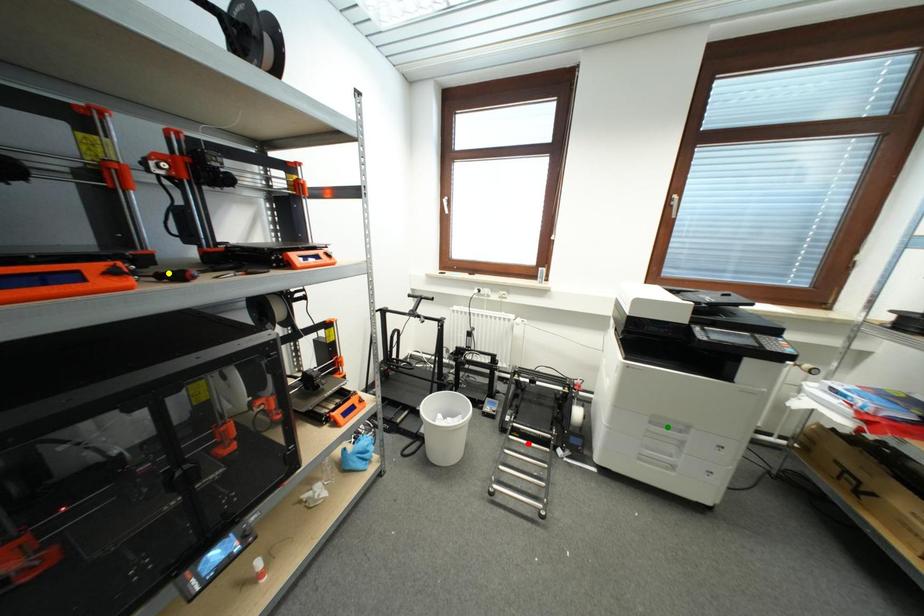
In the scene shown: Order these from nearest to farthest:
1. red point
2. yellow point
3. green point

yellow point < green point < red point